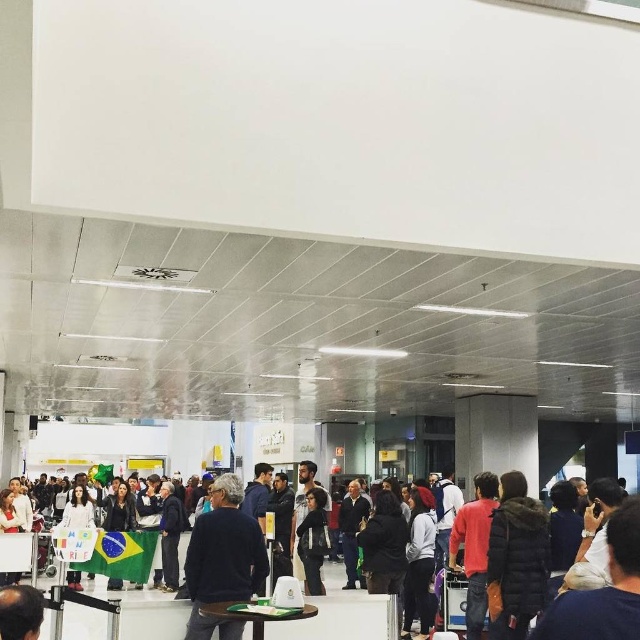
Who is lower down, dark blue jacket at center or dark brown fur coat at center?

dark blue jacket at center is below.

Is dark blue jacket at center in front of dark brown fur coat at center?

Yes, it is.

Based on the photo, who is more distant from viewer, [45,614] or [518,540]?

The point [45,614] is more distant.

In order to click on dark blue jacket at center in this screenshot , I will do coord(340,618).

Consider the image. Which of these two, dark blue sweater at center or dark blue jacket at center, stands shorter?

Standing shorter between the two is dark blue jacket at center.

Does dark blue sweater at center have a larger size compared to dark blue jacket at center?

Indeed, dark blue sweater at center has a larger size compared to dark blue jacket at center.

Is point (193, 621) positioned behind point (276, 636)?

That is False.

Identify the location of dark blue sweater at center. The height and width of the screenshot is (640, 640). 224,560.

Between dark blue sweater at center and dark brown fur coat at center, which one is positioned higher?

dark blue sweater at center is above.

Where is `dark blue sweater at center`? The height and width of the screenshot is (640, 640). dark blue sweater at center is located at coordinates (224, 560).

Which is behind, point (204, 586) or point (532, 563)?

Positioned behind is point (532, 563).

Locate an element on the screen. This screenshot has height=640, width=640. dark blue sweater at center is located at coordinates (224, 560).